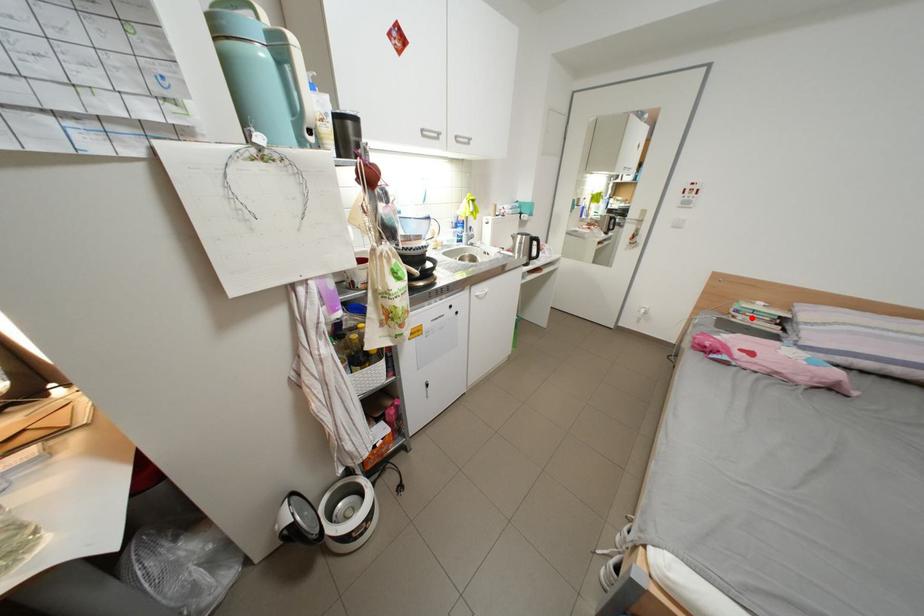
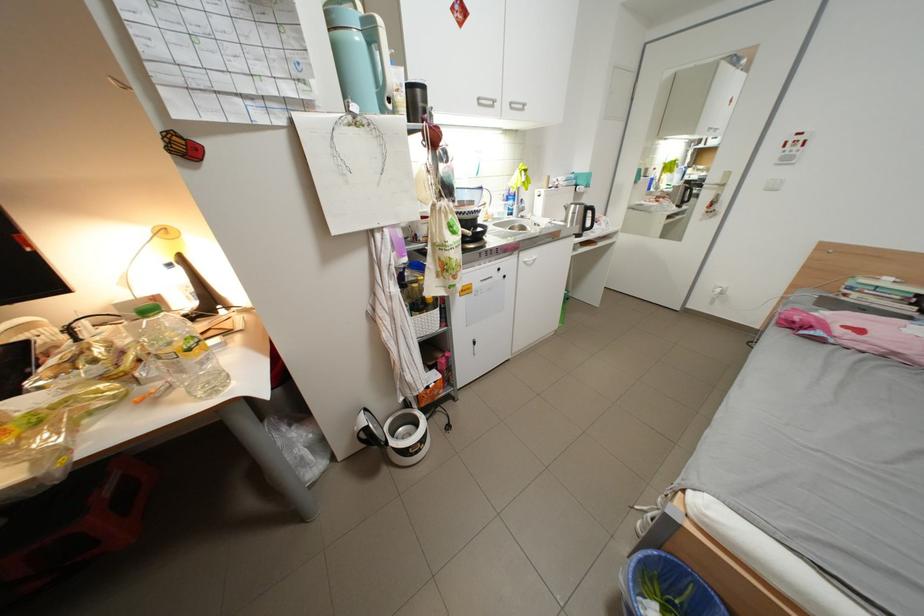
Locate, in the second image, the point that corresponds to the highlighted location in the first image.

(867, 296)